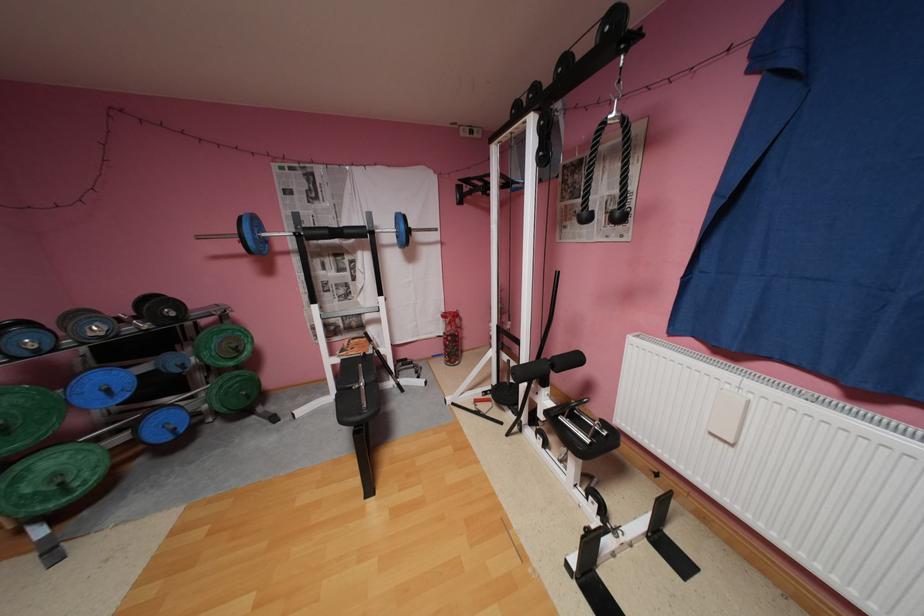
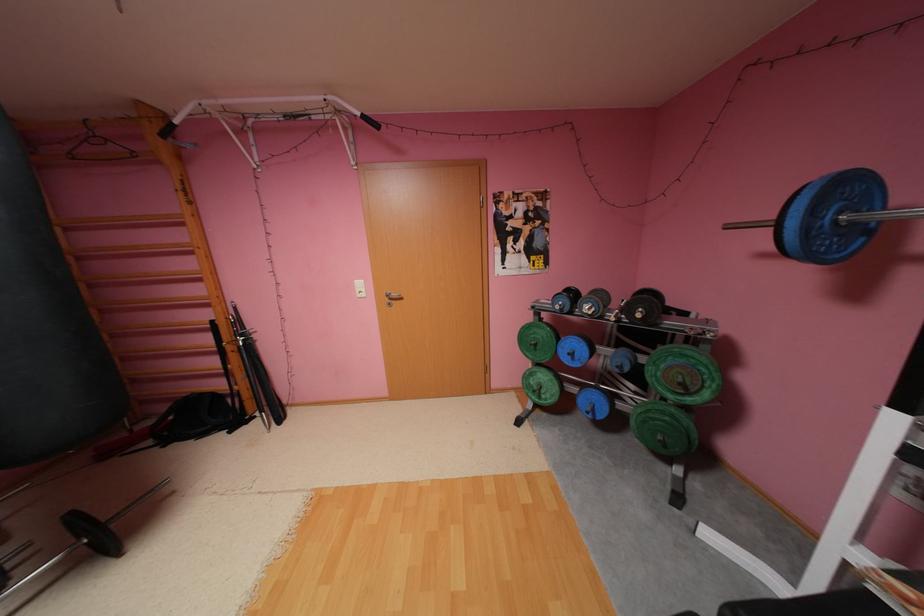
Where in the second image is the point corresponding to the point at 246,347 from the first image?

(690, 384)